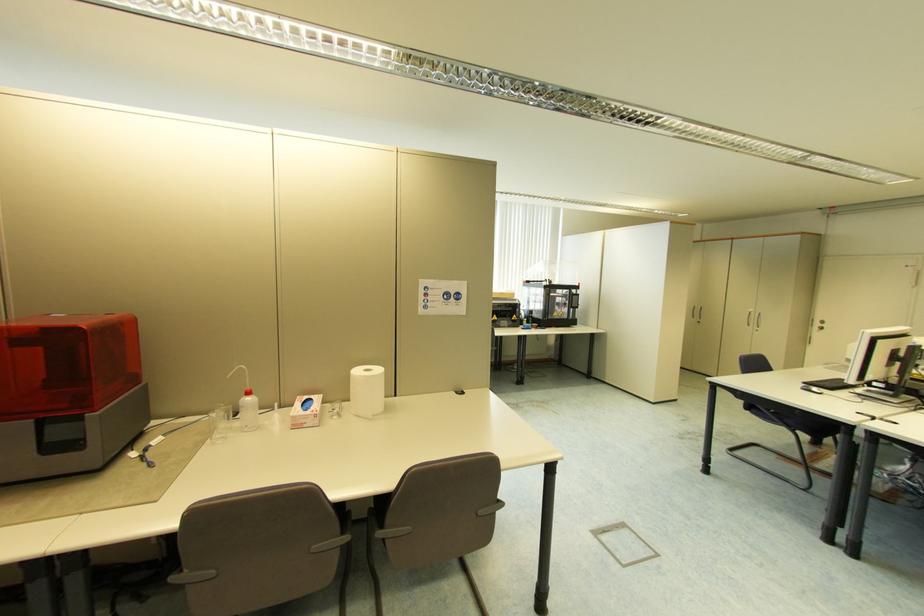
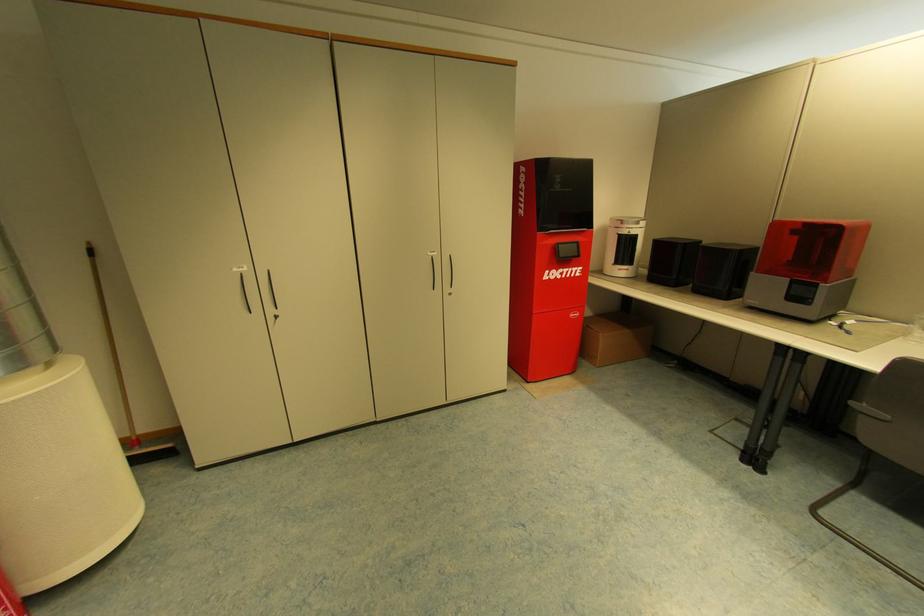
Find the pixel in the second image that matches point (35, 421) in the first image.

(793, 280)